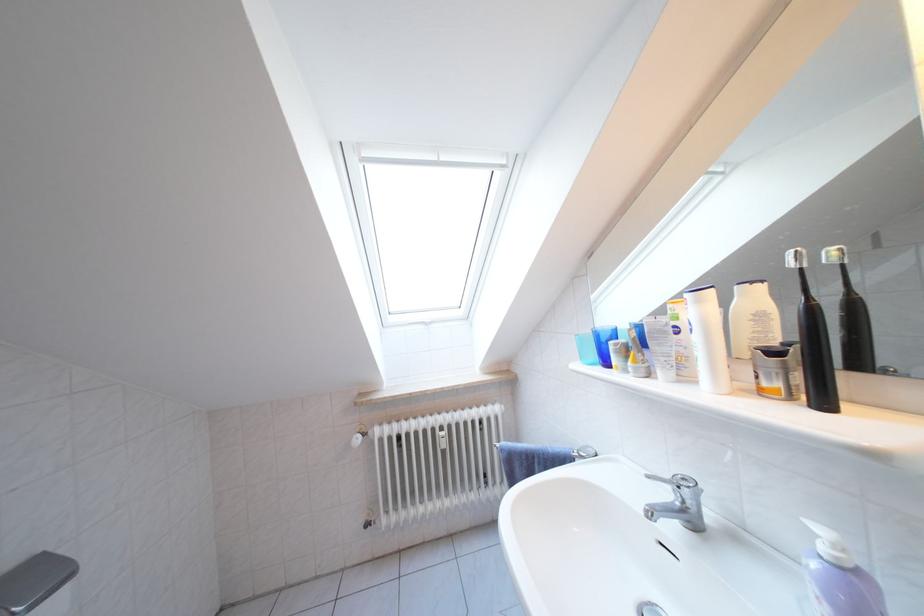
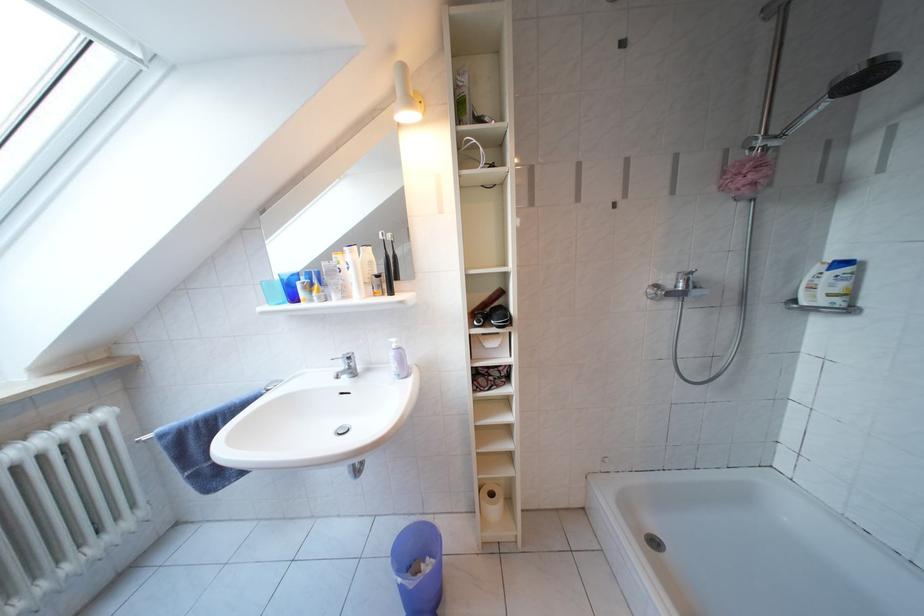
The point at (x=783, y=359) is marked in the first image. Where is the corresponding point in the second image?

(386, 281)